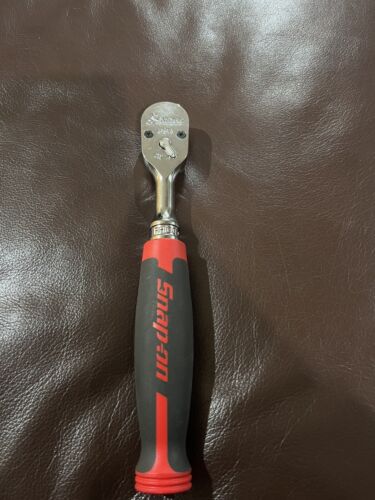
You are a GUI agent. You are given a task and a screenshot of the screen. Output one action in this format:
    pyautogui.click(x=<x>, y=<y>)
    Task: Click on the creases on leather upholstery
    Image resolution: width=375 pixels, height=500 pixels.
    Given the screenshot: What is the action you would take?
    pyautogui.click(x=46, y=385), pyautogui.click(x=84, y=449), pyautogui.click(x=258, y=346), pyautogui.click(x=292, y=433), pyautogui.click(x=292, y=288)